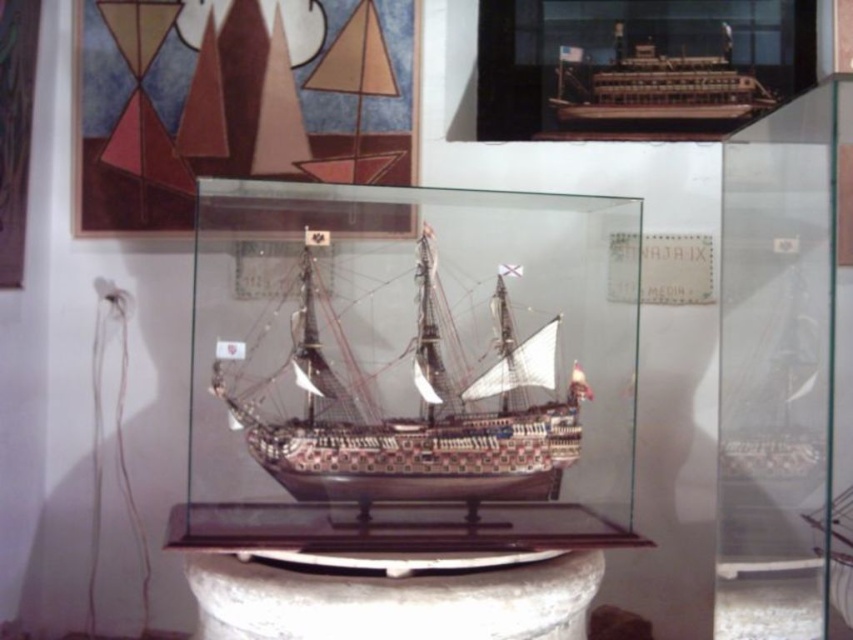
You are standing in front of the glass display box containing the historical sailing ship model. Your current position is at point [329,456]. If you want to observe the ship from a distance of 2 meters, should you move closer to or farther away from the display box?

The point [329,456] is currently 1.58 meters away from you. To reach a distance of 2 meters from the ship, you should move farther away from the display box.